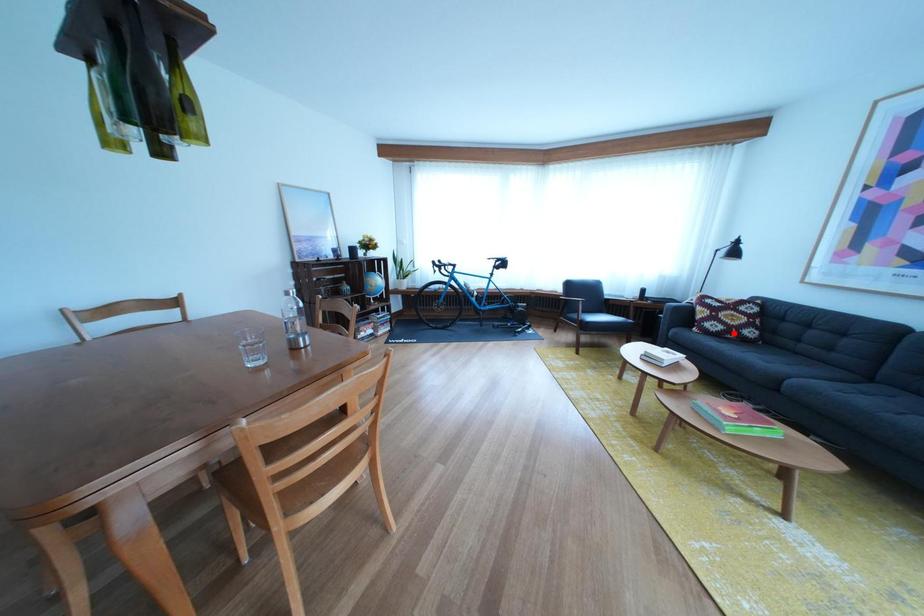
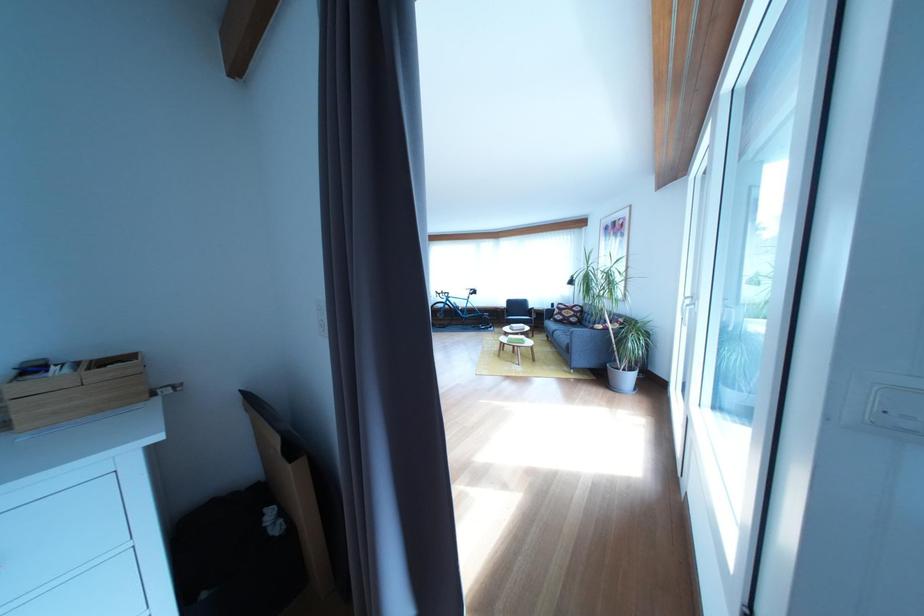
Locate, in the second image, the point that corresponds to the highlighted location in the first image.

(575, 323)